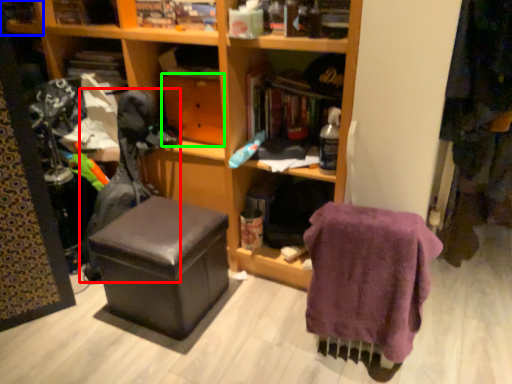
Question: Estimate the real-world distances between objects in this image. Which object is closer to swivel chair (highlighted by a red box), shelf (highlighted by a blue box) or drawer (highlighted by a green box)?

Choices:
 (A) shelf
 (B) drawer

Answer: (B)